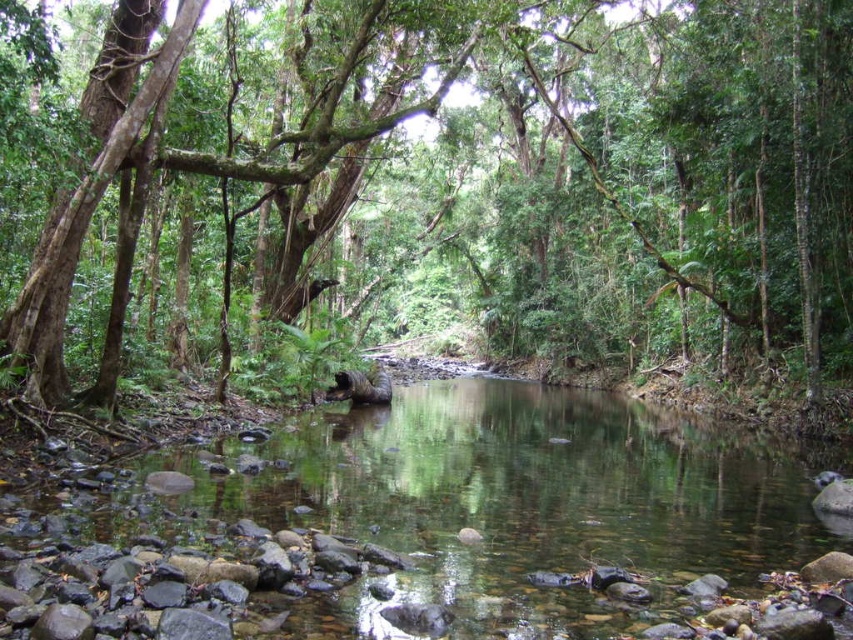
You are standing at the edge of the stream in the forest scene. You notice a point marked at coordinates (482, 177). What object is located at that specific point?

The green leafy tree at center is located at point (482, 177).

You are a hiker standing at the edge of the forest. You want to take a photo of the green leafy tree at center and the clear water stream at center. How far apart are these two features in the scene?

The green leafy tree at center is 18.37 meters away from the clear water stream at center.